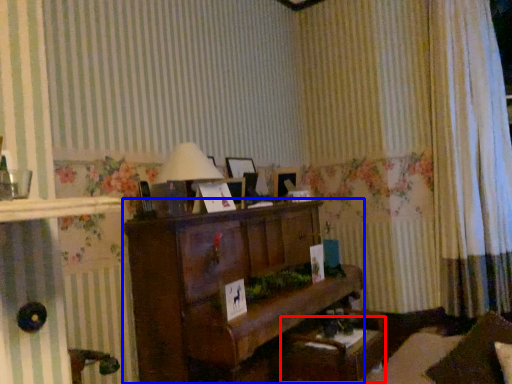
Question: Which of the following is the farthest to the observer, table (highlighted by a red box) or furniture (highlighted by a blue box)?

Choices:
 (A) table
 (B) furniture

Answer: (A)